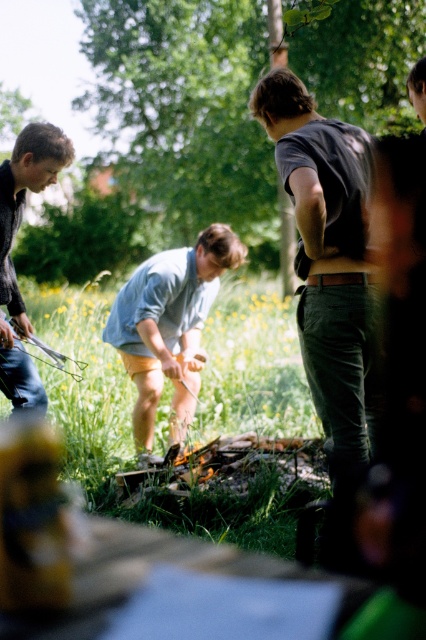
Is light blue denim shorts at center taller than matte black jacket at left?

No, light blue denim shorts at center is not taller than matte black jacket at left.

Who is positioned more to the right, light blue denim shorts at center or matte black jacket at left?

light blue denim shorts at center

Locate an element on the screen. light blue denim shorts at center is located at coordinates (169, 324).

I want to click on light blue denim shorts at center, so click(x=169, y=324).

Looking at this image, does green grass at center have a lesser width compared to matte black jacket at left?

No, green grass at center is not thinner than matte black jacket at left.

Does point (97, 344) lie in front of point (40, 403)?

That is False.

Is point (144, 512) less distant than point (23, 154)?

Yes.

This screenshot has width=426, height=640. Find the location of `green grass at center`. green grass at center is located at coordinates (195, 413).

Where is `green grass at center`? The image size is (426, 640). green grass at center is located at coordinates coord(195,413).

Which is more to the left, green grass at center or light blue denim shorts at center?

Positioned to the left is green grass at center.

Is point (242, 515) positioned in front of point (206, 305)?

Yes, point (242, 515) is closer to viewer.

Identify the location of green grass at center. The height and width of the screenshot is (640, 426). pyautogui.click(x=195, y=413).